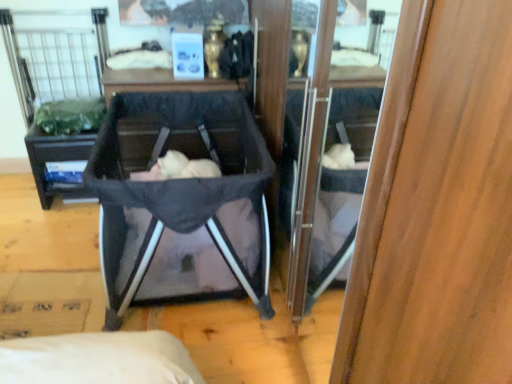
Question: Considering the relative sizes of soft pink fabric at center and black matte vanity at center in the image provided, is soft pink fabric at center bigger than black matte vanity at center?

Choices:
 (A) no
 (B) yes

Answer: (B)

Question: Would you say soft pink fabric at center contains black matte vanity at center?

Choices:
 (A) no
 (B) yes

Answer: (A)

Question: Does soft pink fabric at center come in front of black matte vanity at center?

Choices:
 (A) no
 (B) yes

Answer: (B)

Question: Can you confirm if soft pink fabric at center is positioned to the right of black matte vanity at center?

Choices:
 (A) no
 (B) yes

Answer: (B)

Question: Considering the relative sizes of soft pink fabric at center and black matte vanity at center in the image provided, is soft pink fabric at center wider than black matte vanity at center?

Choices:
 (A) yes
 (B) no

Answer: (A)

Question: Is soft pink fabric at center bigger or smaller than dark gray fabric baby carriage at center?

Choices:
 (A) big
 (B) small

Answer: (B)

Question: Choose the correct answer: Is soft pink fabric at center inside dark gray fabric baby carriage at center or outside it?

Choices:
 (A) outside
 (B) inside

Answer: (B)

Question: Relative to dark gray fabric baby carriage at center, is soft pink fabric at center in front or behind?

Choices:
 (A) front
 (B) behind

Answer: (B)

Question: From a real-world perspective, relative to dark gray fabric baby carriage at center, is soft pink fabric at center vertically above or below?

Choices:
 (A) below
 (B) above

Answer: (A)

Question: Does point (223, 210) appear closer or farther from the camera than point (489, 319)?

Choices:
 (A) farther
 (B) closer

Answer: (A)

Question: From the image's perspective, relative to wooden cabinet at center, is soft pink fabric at center above or below?

Choices:
 (A) above
 (B) below

Answer: (B)

Question: Considering the positions of soft pink fabric at center and wooden cabinet at center in the image, is soft pink fabric at center wider or thinner than wooden cabinet at center?

Choices:
 (A) thin
 (B) wide

Answer: (B)

Question: Is soft pink fabric at center inside the boundaries of wooden cabinet at center, or outside?

Choices:
 (A) inside
 (B) outside

Answer: (B)

Question: Does point (476, 105) appear closer or farther from the camera than point (244, 215)?

Choices:
 (A) closer
 (B) farther

Answer: (A)

Question: Looking at the image, does wooden cabinet at center seem bigger or smaller compared to soft pink fabric at center?

Choices:
 (A) small
 (B) big

Answer: (B)